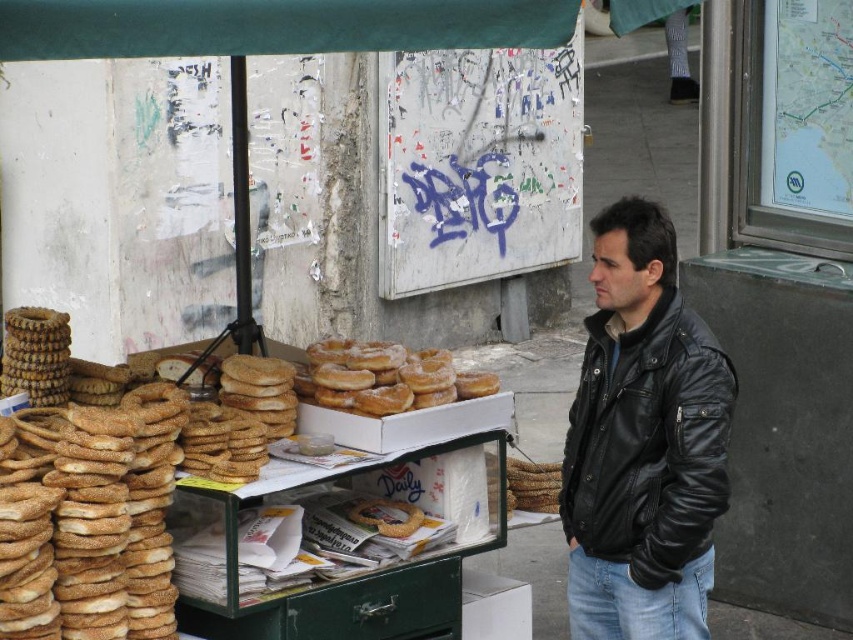
You are a customer standing at the entrance of the food stall. You see the sugared doughnut at center. Can you reach it without moving closer?

The sugared doughnut at center is 4.96 meters from the camera, so you cannot reach it without moving closer.